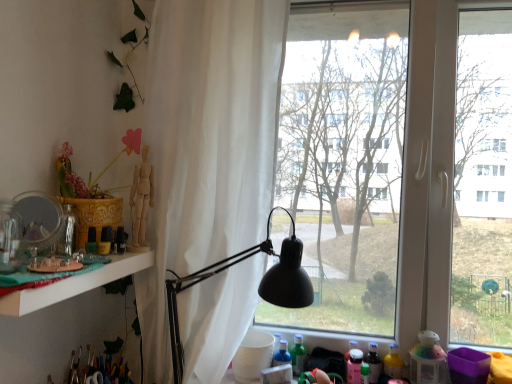
Question: Is matte silver mirror at left turned away from green matte bottle at lower center, placed as the 1th bottle when sorted from left to right?

Choices:
 (A) no
 (B) yes

Answer: (A)

Question: From the image's perspective, does matte silver mirror at left appear lower than green matte bottle at lower center, placed as the 1th bottle when sorted from left to right?

Choices:
 (A) yes
 (B) no

Answer: (B)

Question: Does matte silver mirror at left have a greater height compared to green matte bottle at lower center, which is the second bottle in right-to-left order?

Choices:
 (A) no
 (B) yes

Answer: (A)

Question: From the image's perspective, is matte silver mirror at left located above green matte bottle at lower center, placed as the 1th bottle when sorted from left to right?

Choices:
 (A) yes
 (B) no

Answer: (A)

Question: Is matte silver mirror at left shorter than green matte bottle at lower center, which is the second bottle in right-to-left order?

Choices:
 (A) yes
 (B) no

Answer: (A)

Question: Is green matte bottle at lower center, placed as the 1th bottle when sorted from left to right, surrounded by matte silver mirror at left?

Choices:
 (A) no
 (B) yes

Answer: (A)

Question: Is green matte bottle at lower center, which is the second bottle in right-to-left order, shorter than black matte lamp at center?

Choices:
 (A) no
 (B) yes

Answer: (B)

Question: Is the depth of green matte bottle at lower center, which is the second bottle in right-to-left order, less than that of black matte lamp at center?

Choices:
 (A) no
 (B) yes

Answer: (A)

Question: Considering the relative sizes of green matte bottle at lower center, placed as the 1th bottle when sorted from left to right, and black matte lamp at center in the image provided, is green matte bottle at lower center, placed as the 1th bottle when sorted from left to right, wider than black matte lamp at center?

Choices:
 (A) no
 (B) yes

Answer: (A)

Question: Would you say green matte bottle at lower center, placed as the 1th bottle when sorted from left to right, contains black matte lamp at center?

Choices:
 (A) yes
 (B) no

Answer: (B)

Question: Can you confirm if green matte bottle at lower center, placed as the 1th bottle when sorted from left to right, is positioned to the right of black matte lamp at center?

Choices:
 (A) no
 (B) yes

Answer: (B)

Question: Does green matte bottle at lower center, placed as the 1th bottle when sorted from left to right, appear on the left side of black matte lamp at center?

Choices:
 (A) no
 (B) yes

Answer: (A)

Question: Could you tell me if transparent glass window at center is turned towards translucent plastic bottle at lower right, the 2th bottle from the left?

Choices:
 (A) yes
 (B) no

Answer: (A)